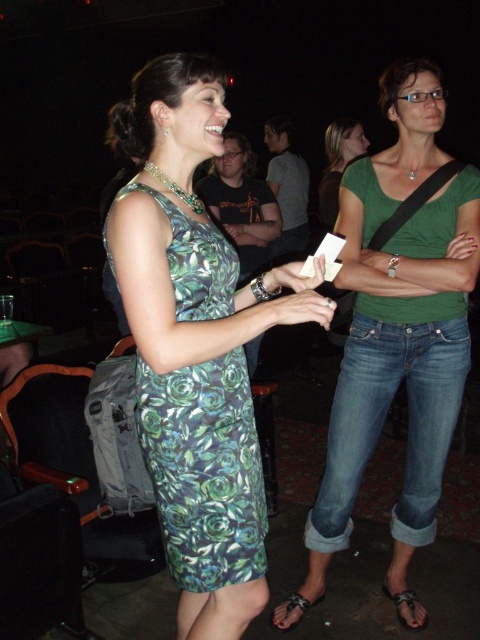
Question: Where is dark green t-shirt at center located in relation to brown leather sandal at lower right in the image?

Choices:
 (A) above
 (B) below

Answer: (A)

Question: Which point is closer to the camera?

Choices:
 (A) dark gray shirt at center
 (B) green cotton shirt at center

Answer: (B)

Question: Does green cotton shirt at center appear on the right side of brown leather sandal at lower right?

Choices:
 (A) no
 (B) yes

Answer: (A)

Question: Which point is closer to the camera taking this photo?

Choices:
 (A) (277, 237)
 (B) (200, 182)
 (C) (319, 600)
 (D) (468, 276)

Answer: (D)

Question: Which object appears closest to the camera in this image?

Choices:
 (A) dark gray shirt at center
 (B) dark green t-shirt at center
 (C) leather sandal at lower center
 (D) green cotton shirt at center

Answer: (D)

Question: Does green cotton shirt at center come behind brown leather sandal at lower right?

Choices:
 (A) yes
 (B) no

Answer: (B)